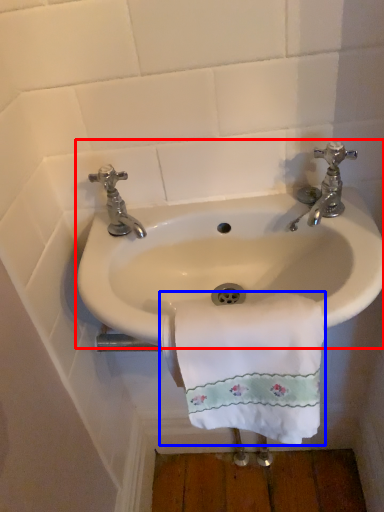
Question: Among these objects, which one is farthest to the camera, sink (highlighted by a red box) or towel/napkin (highlighted by a blue box)?

Choices:
 (A) sink
 (B) towel/napkin

Answer: (A)